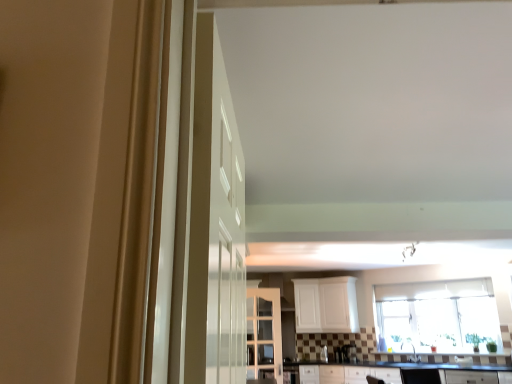
Question: From a real-world perspective, is white matte cabinet at center, which is counted as the 2th cabinetry, starting from the left, above or below clear glass window at center?

Choices:
 (A) above
 (B) below

Answer: (A)

Question: From the image's perspective, is white matte cabinet at center, which is the first cabinetry in back-to-front order, above or below clear glass window at center?

Choices:
 (A) above
 (B) below

Answer: (B)

Question: Which object is positioned farthest from the white glossy door at center?

Choices:
 (A) black laminate countertop at lower center
 (B) white glossy cabinet at center, acting as the 1th cabinetry starting from the front
 (C) clear glass window at center
 (D) white matte cabinet at center, marked as the first cabinetry in a right-to-left arrangement
 (E) white glossy sink at center

Answer: (C)

Question: Which object is the closest to the white glossy sink at center?

Choices:
 (A) white glossy cabinet at center, which is counted as the 2th cabinetry, starting from the right
 (B) white glossy door at center
 (C) black laminate countertop at lower center
 (D) white matte cabinet at center, which is counted as the 2th cabinetry, starting from the left
 (E) clear glass window at center

Answer: (C)